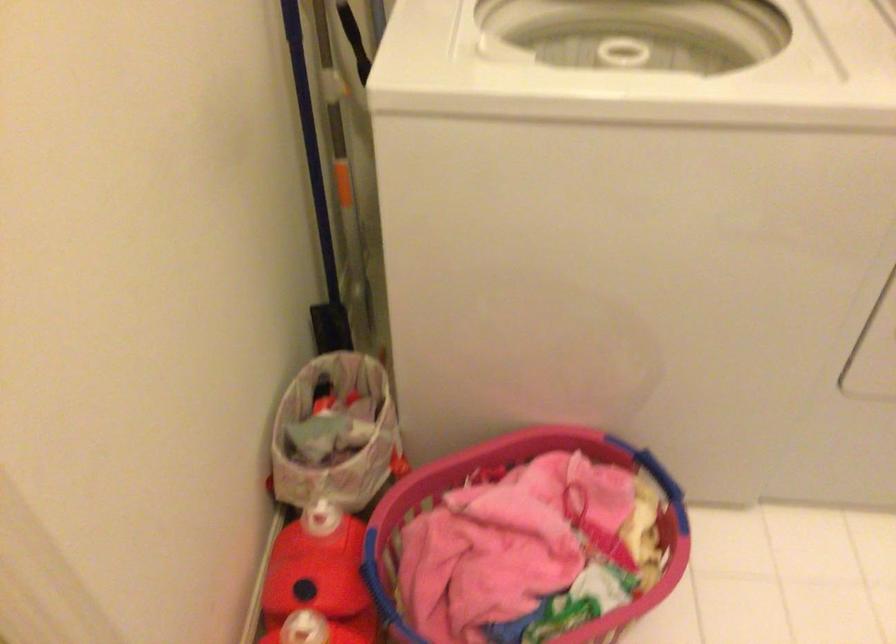
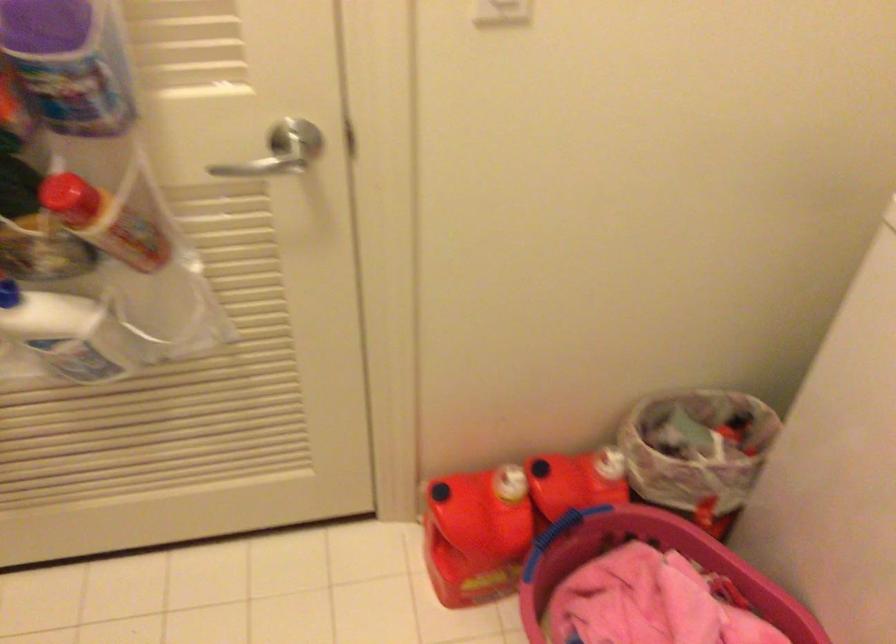
Find the pixel in the second image that matches (329,513) in the first image.

(618, 468)